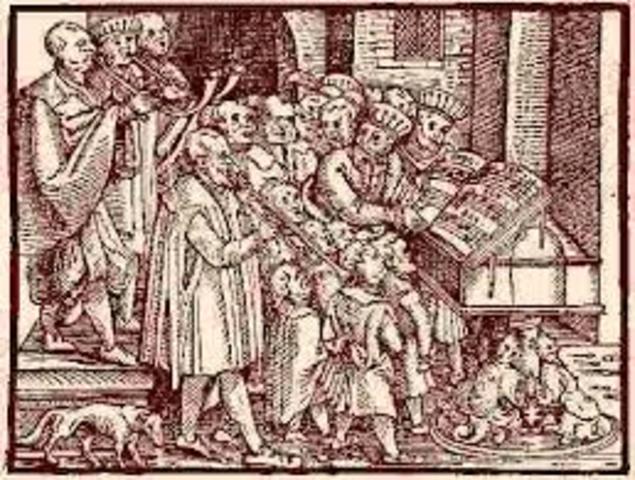
Where is `window`? window is located at coordinates (415, 31).